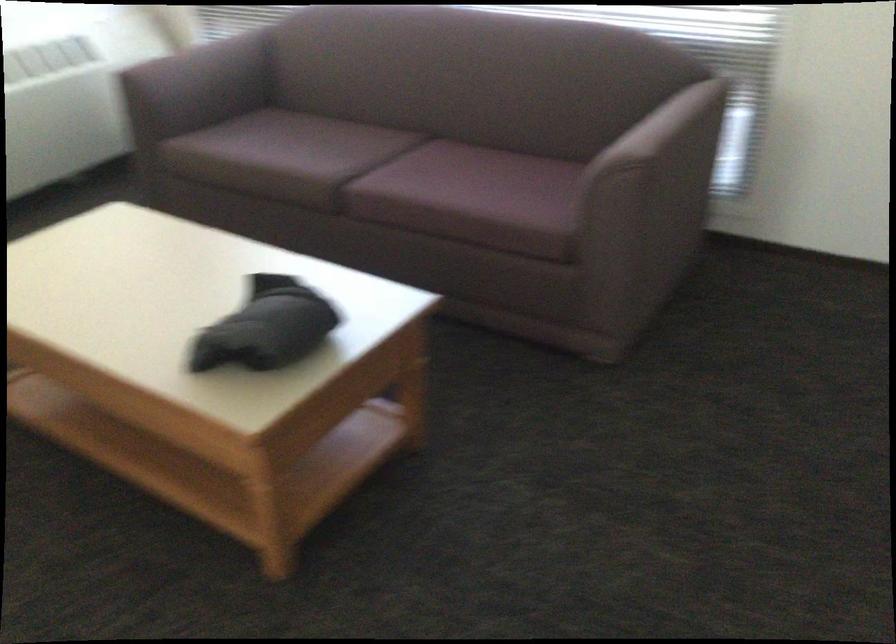
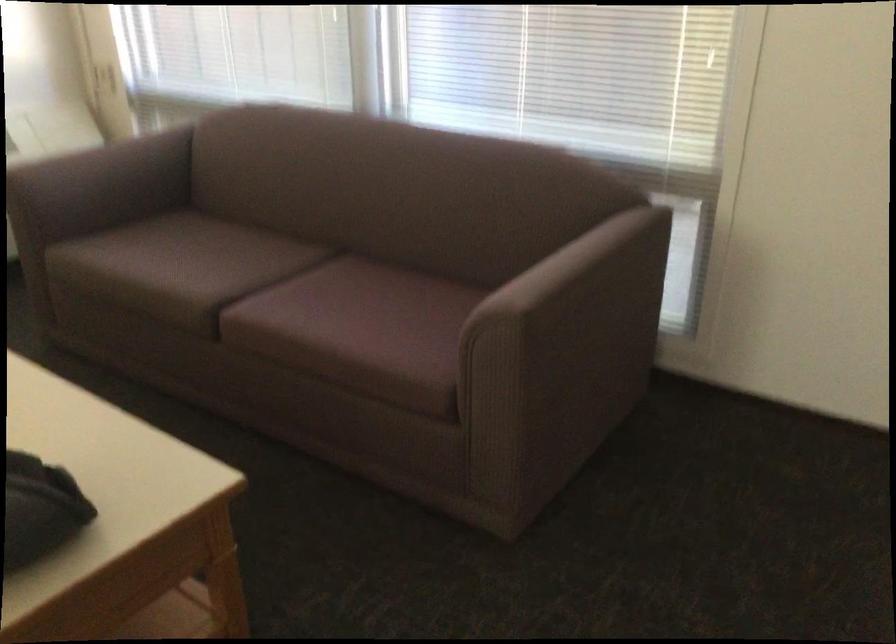
Find the pixel in the second image that matches (x=391, y=174) in the first image.

(277, 299)